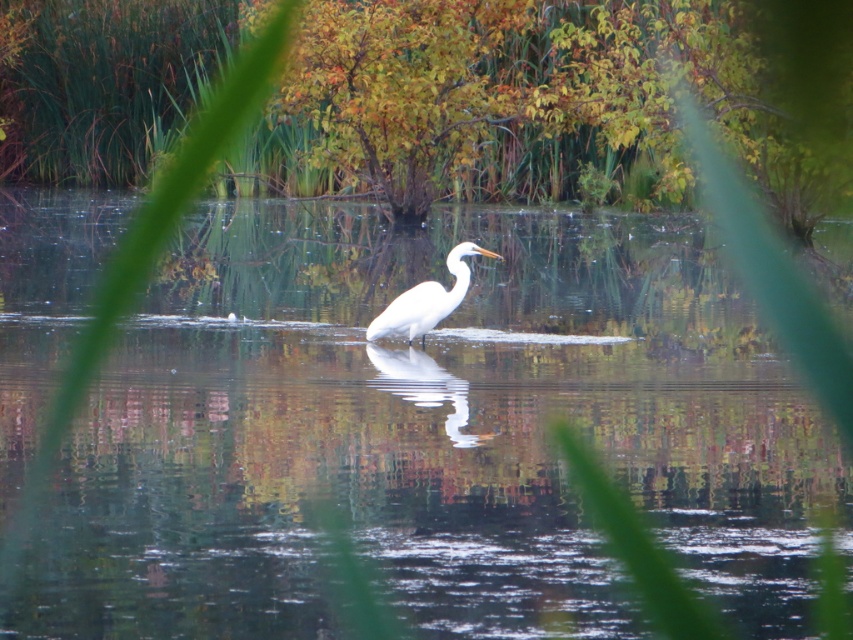
Can you confirm if clear water at center is positioned above white smooth heron at center?

Yes.

Is point (444, 538) farther from camera compared to point (422, 284)?

That is False.

You are a GUI agent. You are given a task and a screenshot of the screen. Output one action in this format:
    pyautogui.click(x=<x>, y=<y>)
    Task: Click on the clear water at center
    This screenshot has width=853, height=640.
    Given the screenshot: What is the action you would take?
    pyautogui.click(x=430, y=433)